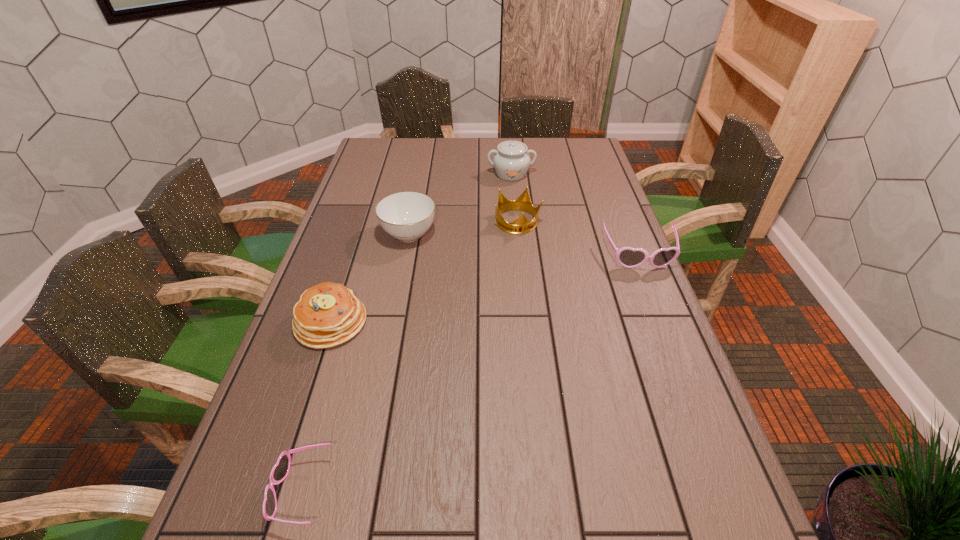
At what (x,y) coordinates should I click in order to perform the action: click on the nearest object. Please return your answer as a coordinate pair (x, y). The width and height of the screenshot is (960, 540). Looking at the image, I should click on (280, 470).

Where is `the shortest object`? This screenshot has height=540, width=960. the shortest object is located at coordinates (280, 470).

You are a GUI agent. You are given a task and a screenshot of the screen. Output one action in this format:
    pyautogui.click(x=<x>, y=<y>)
    Task: Click on the taller sunglasses
    
    Given the screenshot: What is the action you would take?
    pyautogui.click(x=628, y=257)

At what (x,y) coordinates should I click in order to perform the action: click on the right sunglasses. Please return your answer as a coordinate pair (x, y). This screenshot has height=540, width=960. Looking at the image, I should click on (628, 257).

Image resolution: width=960 pixels, height=540 pixels. What are the coordinates of `crown` in the screenshot? It's located at (522, 225).

Image resolution: width=960 pixels, height=540 pixels. In order to click on the farthest object in this screenshot , I will do `click(511, 162)`.

Locate an element on the screen. The width and height of the screenshot is (960, 540). the tallest object is located at coordinates (511, 162).

Locate an element on the screen. The height and width of the screenshot is (540, 960). the shorter chinaware is located at coordinates (406, 216).

Locate an element on the screen. This screenshot has width=960, height=540. the left chinaware is located at coordinates (406, 216).

Where is `the fifth farthest object`? The image size is (960, 540). the fifth farthest object is located at coordinates (328, 314).